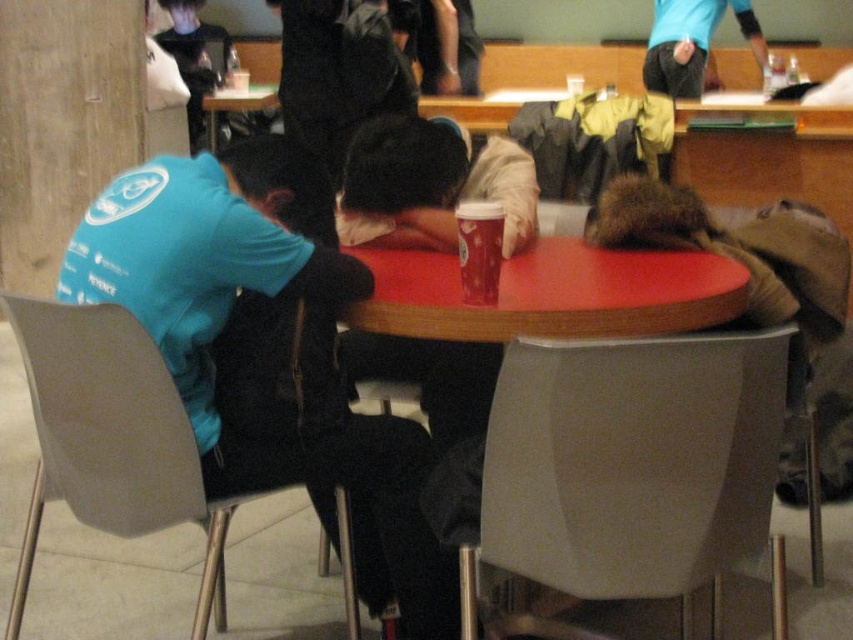
Looking at this image, you are a person sitting on the matte gray chair at lower center. You want to place a book on the smooth red table at center. Can you reach the table from your current position?

The matte gray chair at lower center is located below smooth red table at center, so yes, you can reach the table from your current position.

You are a photographer trying to capture a candid shot of the two people at the smooth red table at center. You notice the blue fleece jacket at left might block your view. Based on their heights, can you estimate whether the jacket is taller than the table?

The blue fleece jacket at left is taller than the smooth red table at center, so it might block your view if positioned between the photographer and the subjects.

You are a person who is 1.7 meters tall and want to sit comfortably at the table. Given that the matte gray chair at lower center and the matte plastic chair at lower left are available, which chair would provide a better seating height for you?

The matte plastic chair at lower left has a greater height compared to the matte gray chair at lower center, so it would provide a better seating height for someone who is 1.7 meters tall.